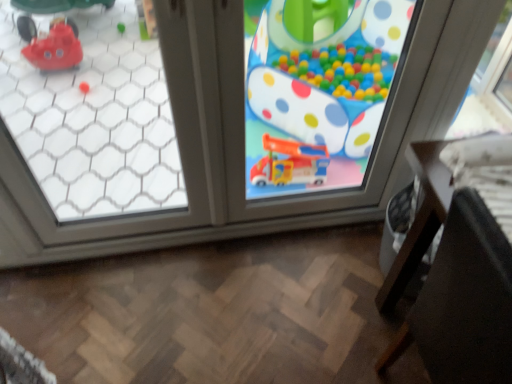
Question: From a real-world perspective, is transparent glass window at center, the second window in the left-to-right sequence, below black leather chair at lower right?

Choices:
 (A) yes
 (B) no

Answer: (B)

Question: From the image's perspective, is transparent glass window at center, the 1th window when ordered from right to left, over black leather chair at lower right?

Choices:
 (A) no
 (B) yes

Answer: (B)

Question: Considering the relative positions of transparent glass window at center, the second window in the left-to-right sequence, and black leather chair at lower right in the image provided, is transparent glass window at center, the second window in the left-to-right sequence, to the right of black leather chair at lower right from the viewer's perspective?

Choices:
 (A) yes
 (B) no

Answer: (B)

Question: Can you confirm if transparent glass window at center, the second window in the left-to-right sequence, is thinner than black leather chair at lower right?

Choices:
 (A) yes
 (B) no

Answer: (A)

Question: Does transparent glass window at center, the second window in the left-to-right sequence, come behind black leather chair at lower right?

Choices:
 (A) no
 (B) yes

Answer: (B)

Question: Is there a large distance between transparent glass window at center, the 1th window when ordered from right to left, and black leather chair at lower right?

Choices:
 (A) yes
 (B) no

Answer: (A)

Question: Is transparent glass window at center, the second window in the left-to-right sequence, completely or partially inside transparent glass window at upper left, which is the first window from left to right?

Choices:
 (A) no
 (B) yes

Answer: (B)

Question: Is the position of transparent glass window at upper left, placed as the 2th window when sorted from right to left, less distant than that of transparent glass window at center, the 1th window when ordered from right to left?

Choices:
 (A) no
 (B) yes

Answer: (B)

Question: Is transparent glass window at upper left, placed as the 2th window when sorted from right to left, outside transparent glass window at center, the 1th window when ordered from right to left?

Choices:
 (A) no
 (B) yes

Answer: (A)

Question: Considering the relative sizes of transparent glass window at upper left, placed as the 2th window when sorted from right to left, and transparent glass window at center, the second window in the left-to-right sequence, in the image provided, is transparent glass window at upper left, placed as the 2th window when sorted from right to left, wider than transparent glass window at center, the second window in the left-to-right sequence,?

Choices:
 (A) yes
 (B) no

Answer: (A)

Question: Is transparent glass window at upper left, placed as the 2th window when sorted from right to left, facing away from transparent glass window at center, the 1th window when ordered from right to left?

Choices:
 (A) no
 (B) yes

Answer: (B)

Question: From the image's perspective, is transparent glass window at upper left, placed as the 2th window when sorted from right to left, beneath transparent glass window at center, the 1th window when ordered from right to left?

Choices:
 (A) no
 (B) yes

Answer: (B)

Question: Is matte plastic toy at center placed right next to black leather chair at lower right?

Choices:
 (A) yes
 (B) no

Answer: (B)